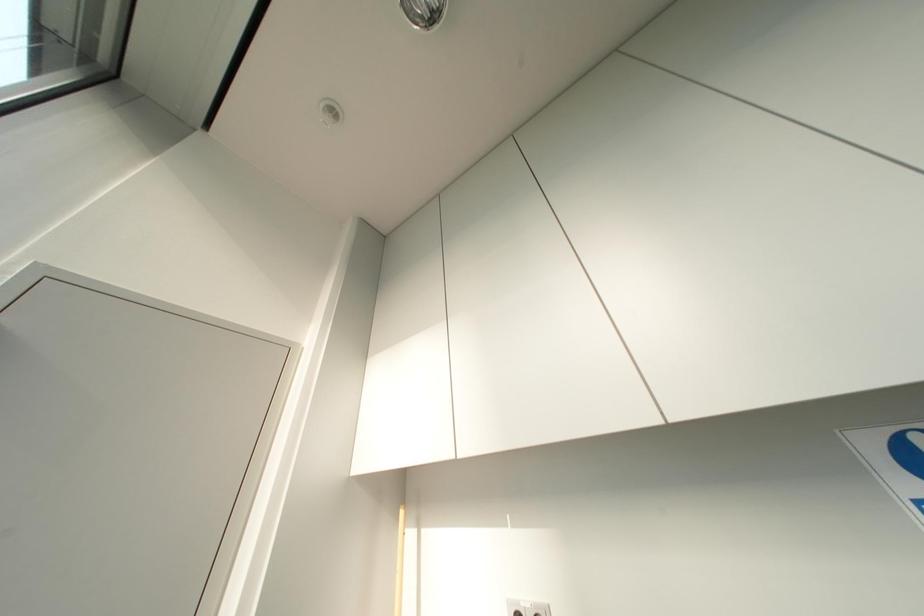
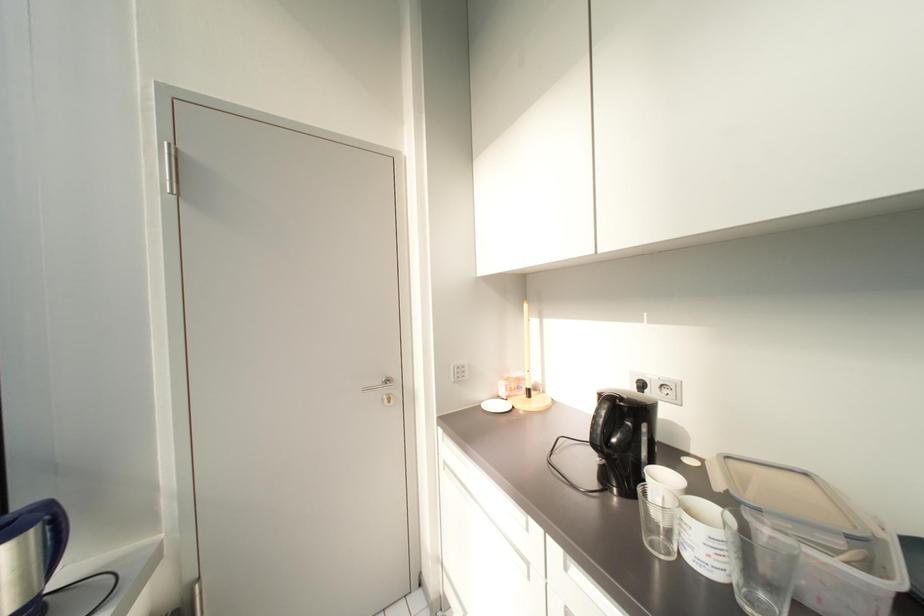
How did the camera likely rotate?

The camera rotated toward left-down.